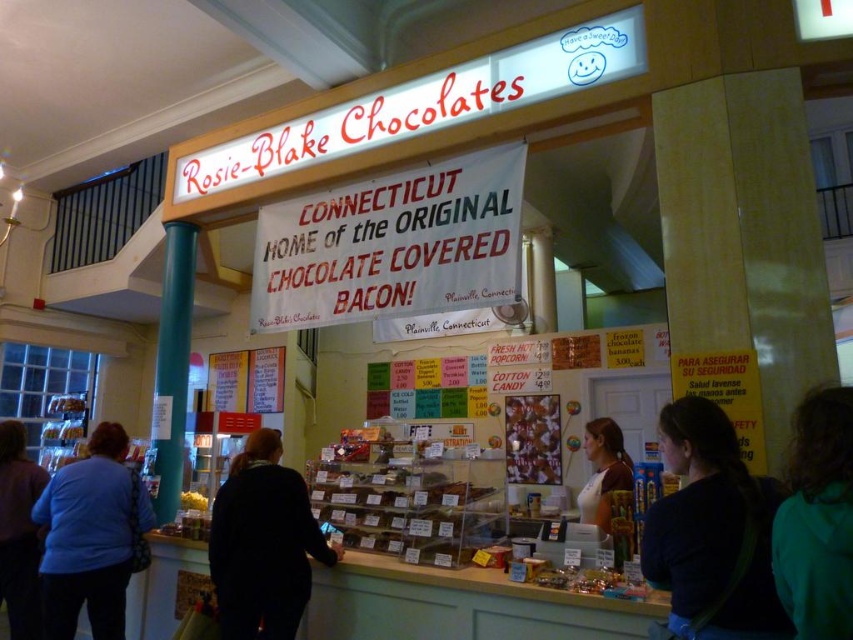
You are a customer in the shop and want to reach both the dark green hoodie at lower right and the dark blue sweater at lower left. Which item is shorter and needs to be stretched less to reach?

The dark green hoodie at lower right has a lesser height compared to the dark blue sweater at lower left, so you would need to stretch less to reach the dark green hoodie at lower right.

You are a customer in Rosie Blake Chocolates and want to know if the translucent plastic chocolate at center can be placed on a shelf next to the dark green hoodie at lower right. The shelf has enough space for items wider than the hoodie. Can the chocolate fit?

The translucent plastic chocolate at center is wider than the dark green hoodie at lower right, so it can fit on the shelf since the shelf requires items wider than the hoodie.